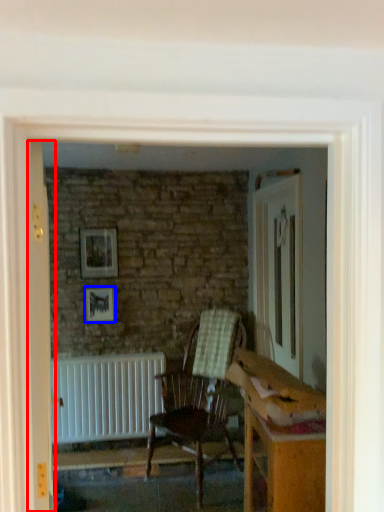
Question: Which object appears farthest to the camera in this image, door (highlighted by a red box) or picture frame (highlighted by a blue box)?

Choices:
 (A) door
 (B) picture frame

Answer: (B)